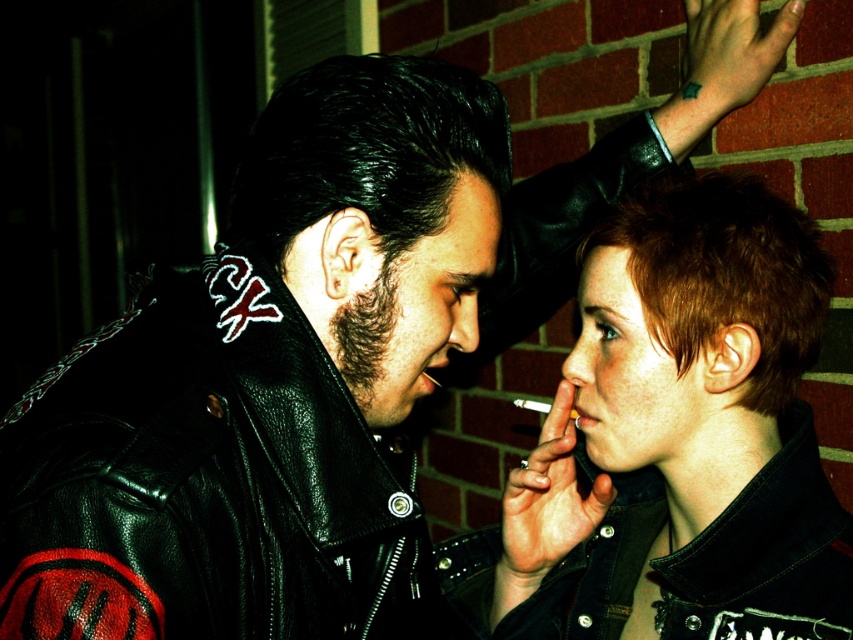
Question: In this image, where is denim jacket at center located relative to black leather jacket at upper left?

Choices:
 (A) below
 (B) above

Answer: (A)

Question: Which point is closer to the camera?

Choices:
 (A) black leather jacket at upper left
 (B) denim jacket at center

Answer: (A)

Question: Which of the following is the closest to the observer?

Choices:
 (A) (548, 442)
 (B) (117, 408)

Answer: (B)

Question: Considering the relative positions of denim jacket at center and black leather jacket at upper left in the image provided, where is denim jacket at center located with respect to black leather jacket at upper left?

Choices:
 (A) left
 (B) right

Answer: (B)

Question: Which point is farther to the camera?

Choices:
 (A) (695, 276)
 (B) (236, 342)

Answer: (A)

Question: Does denim jacket at center lie in front of black leather jacket at upper left?

Choices:
 (A) no
 (B) yes

Answer: (A)